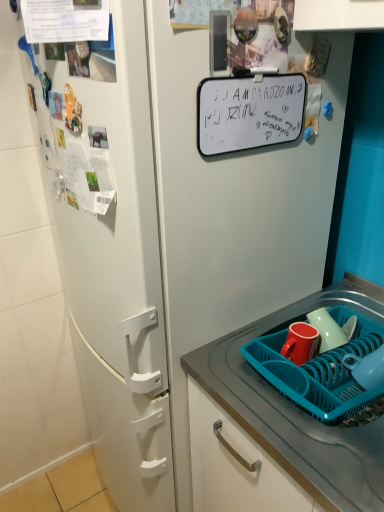
Question: In the image, is glossy ceramic mug at lower right positioned in front of or behind teal plastic tray at lower right?

Choices:
 (A) behind
 (B) front

Answer: (A)

Question: Looking at the image, does glossy ceramic mug at lower right seem bigger or smaller compared to teal plastic tray at lower right?

Choices:
 (A) big
 (B) small

Answer: (B)

Question: Estimate the real-world distances between objects in this image. Which object is farther from the matte red mug at lower right?

Choices:
 (A) teal plastic tray at lower right
 (B) glossy ceramic mug at lower right
 (C) blue plastic basket at lower right

Answer: (A)

Question: Which object is positioned farthest from the blue plastic basket at lower right?

Choices:
 (A) teal plastic tray at lower right
 (B) glossy ceramic mug at lower right
 (C) matte red mug at lower right

Answer: (B)